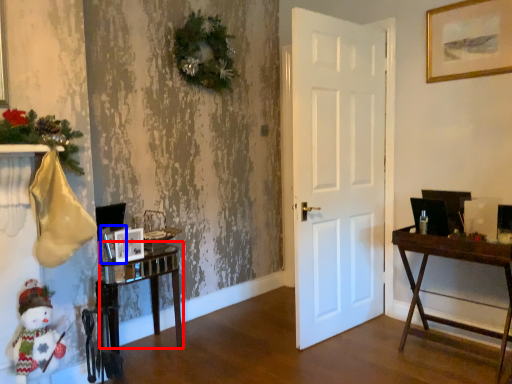
Question: Which point is further to the camera, table (highlighted by a red box) or picture frame (highlighted by a blue box)?

Choices:
 (A) table
 (B) picture frame

Answer: (B)